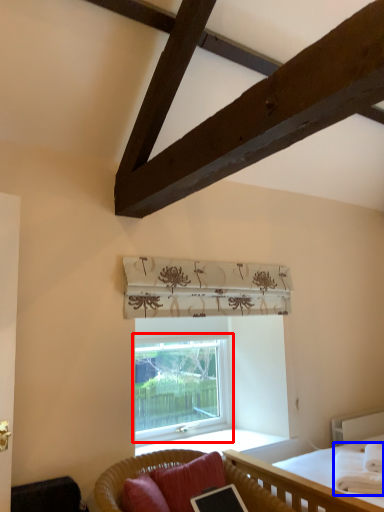
Question: Among these objects, which one is farthest to the camera, window (highlighted by a red box) or blanket (highlighted by a blue box)?

Choices:
 (A) window
 (B) blanket

Answer: (A)